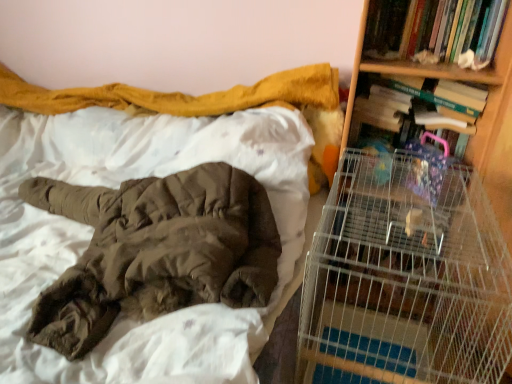
Question: From the image's perspective, is hardcover book at upper right, which is the second book in bottom-to-top order, above brown fuzzy blanket at upper left?

Choices:
 (A) yes
 (B) no

Answer: (A)

Question: Is brown fuzzy blanket at upper left a part of hardcover book at upper right, which is the second book in bottom-to-top order?

Choices:
 (A) no
 (B) yes

Answer: (A)

Question: Can you confirm if hardcover book at upper right, which is the second book in bottom-to-top order, is bigger than brown fuzzy blanket at upper left?

Choices:
 (A) no
 (B) yes

Answer: (A)

Question: Considering the relative sizes of hardcover book at upper right, which is the second book in bottom-to-top order, and brown fuzzy blanket at upper left in the image provided, is hardcover book at upper right, which is the second book in bottom-to-top order, wider than brown fuzzy blanket at upper left?

Choices:
 (A) yes
 (B) no

Answer: (B)

Question: Can you confirm if hardcover book at upper right, which is the first book in top-to-bottom order, is taller than brown fuzzy blanket at upper left?

Choices:
 (A) no
 (B) yes

Answer: (A)

Question: Considering the positions of hardcover book at upper right, which is the second book in bottom-to-top order, and metal wire cage at right in the image, is hardcover book at upper right, which is the second book in bottom-to-top order, taller or shorter than metal wire cage at right?

Choices:
 (A) tall
 (B) short

Answer: (B)

Question: Is hardcover book at upper right, which is the second book in bottom-to-top order, situated inside metal wire cage at right or outside?

Choices:
 (A) inside
 (B) outside

Answer: (B)

Question: Is hardcover book at upper right, which is the second book in bottom-to-top order, to the left or to the right of metal wire cage at right in the image?

Choices:
 (A) left
 (B) right

Answer: (B)

Question: In terms of width, does hardcover book at upper right, which is the second book in bottom-to-top order, look wider or thinner when compared to metal wire cage at right?

Choices:
 (A) wide
 (B) thin

Answer: (B)

Question: From a real-world perspective, is hardcover book at upper right, positioned as the 1th book in bottom-to-top order, positioned above or below brown fuzzy blanket at upper left?

Choices:
 (A) below
 (B) above

Answer: (B)

Question: Would you say hardcover book at upper right, the 2th book from the top, is inside or outside brown fuzzy blanket at upper left?

Choices:
 (A) outside
 (B) inside

Answer: (A)

Question: Is hardcover book at upper right, the 2th book from the top, wider or thinner than brown fuzzy blanket at upper left?

Choices:
 (A) wide
 (B) thin

Answer: (B)

Question: Considering their positions, is hardcover book at upper right, the 2th book from the top, located in front of or behind brown fuzzy blanket at upper left?

Choices:
 (A) front
 (B) behind

Answer: (B)

Question: Is point (314, 354) positioned closer to the camera than point (419, 71)?

Choices:
 (A) closer
 (B) farther

Answer: (A)

Question: Looking at the image, does metal wire cage at right seem bigger or smaller compared to wooden bookshelf at right?

Choices:
 (A) big
 (B) small

Answer: (A)